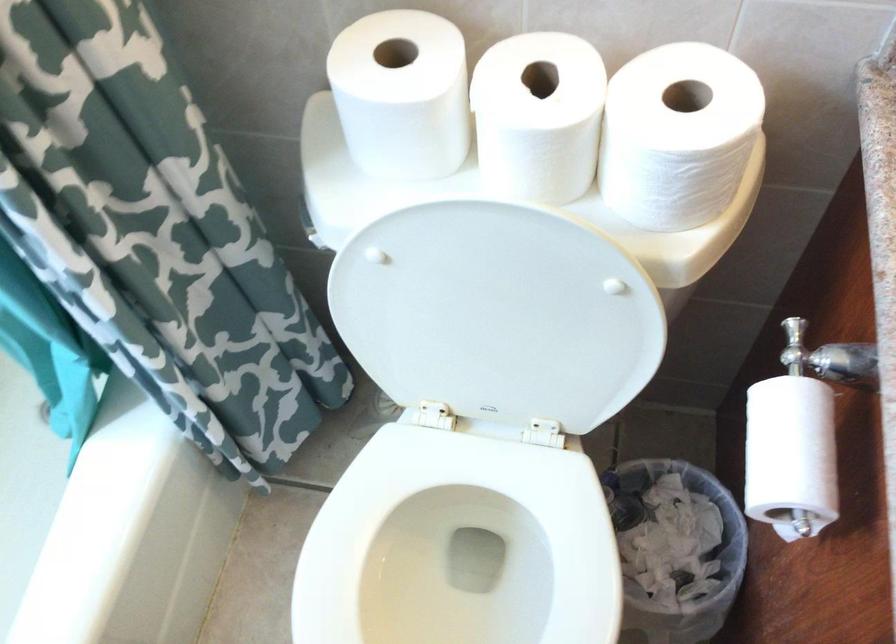
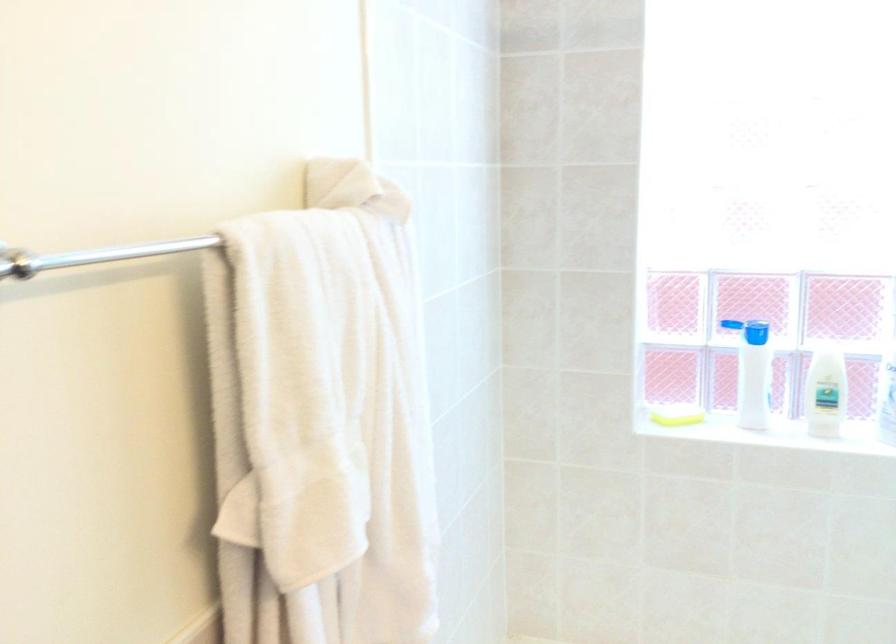
Question: The camera is either moving clockwise (left) or counter-clockwise (right) around the object. The first image is from the beginning of the video and the second image is from the end. Is the camera moving left or right when shooting the video?

Choices:
 (A) Left
 (B) Right

Answer: (B)